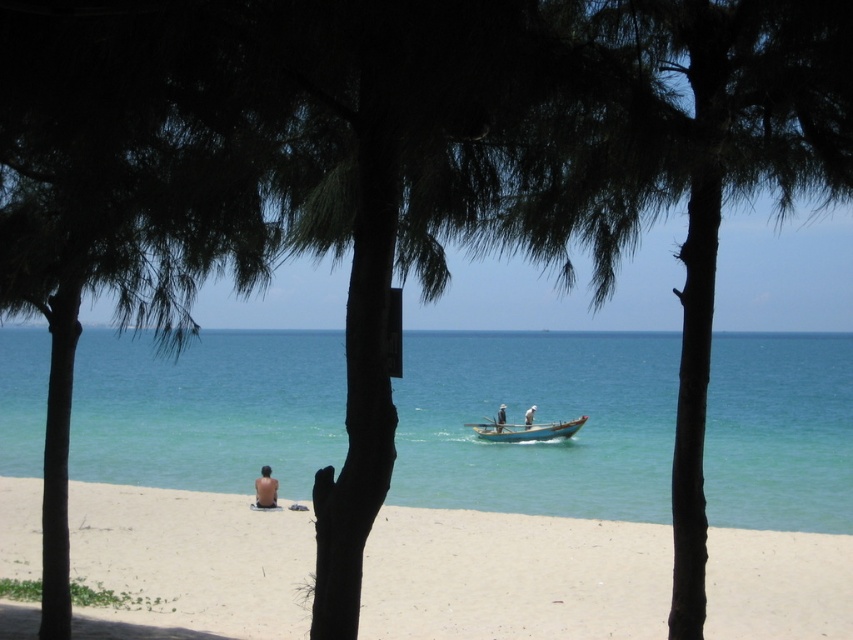
Can you confirm if skinny man at lower left is bigger than white matte person at center?

Correct, skinny man at lower left is larger in size than white matte person at center.

What do you see at coordinates (265, 488) in the screenshot?
I see `skinny man at lower left` at bounding box center [265, 488].

Which is behind, point (262, 493) or point (525, 419)?

The point (525, 419) is more distant.

At what (x,y) coordinates should I click in order to perform the action: click on skinny man at lower left. Please return your answer as a coordinate pair (x, y). The image size is (853, 640). Looking at the image, I should click on (265, 488).

Does point (579, 224) lie behind point (502, 403)?

No, it is not.

Between point (619, 22) and point (497, 424), which one is positioned behind?

The point (497, 424) is behind.

Is point (756, 52) closer to camera compared to point (503, 419)?

Yes, point (756, 52) is in front of point (503, 419).

I want to click on dark green bark palm tree at center, so click(x=689, y=166).

Is white sandy beach at lower center closer to camera compared to white fabric boat at center?

That is True.

Does white sandy beach at lower center have a larger size compared to white fabric boat at center?

Yes.

I want to click on white sandy beach at lower center, so click(x=512, y=577).